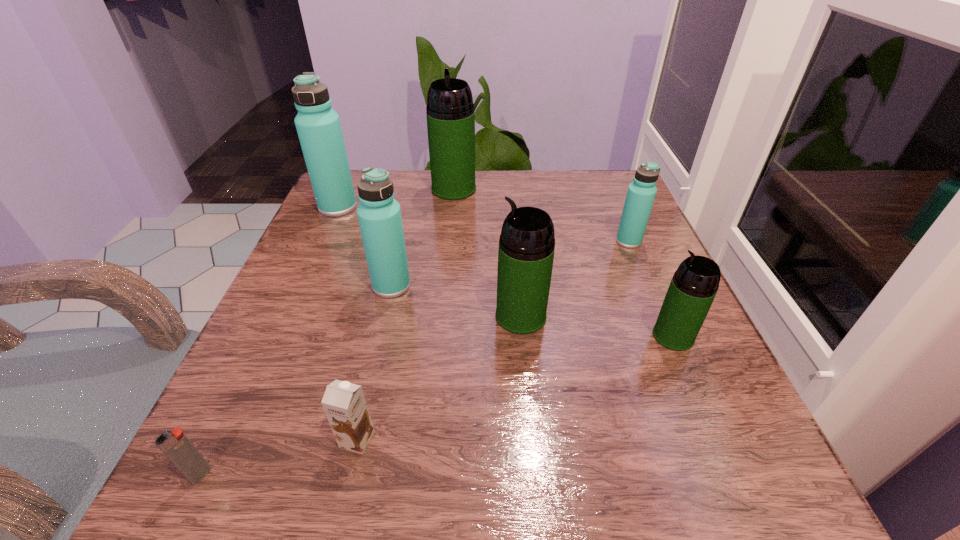
Find the location of `vacant area that lies between the nearest object and the biggest aqua thermos bottle`. vacant area that lies between the nearest object and the biggest aqua thermos bottle is located at coordinates (269, 341).

Where is `free spot between the fifth object from left to right and the leftmost thermos bottle`? The height and width of the screenshot is (540, 960). free spot between the fifth object from left to right and the leftmost thermos bottle is located at coordinates (396, 198).

At what (x,y) coordinates should I click in order to perform the action: click on vacant area between the nearest object and the second farthest aqua thermos bottle. Please return your answer as a coordinate pair (x, y). Looking at the image, I should click on (415, 357).

Find the location of a particular element. This screenshot has height=540, width=960. free space between the rightmost green thermos bottle and the second farthest aqua thermos bottle is located at coordinates coord(651,288).

Find the location of a particular element. free space between the shortest object and the biggest green thermos bottle is located at coordinates (327, 332).

Locate an element on the screen. This screenshot has height=540, width=960. free area in between the seventh farthest object and the biggest aqua thermos bottle is located at coordinates 348,323.

Where is `vacant space that is in between the third farthest thermos bottle and the chocolate milk`? This screenshot has width=960, height=540. vacant space that is in between the third farthest thermos bottle and the chocolate milk is located at coordinates (492, 340).

The image size is (960, 540). Find the location of `unoccupied area between the chocolate milk and the smallest green thermos bottle`. unoccupied area between the chocolate milk and the smallest green thermos bottle is located at coordinates (516, 388).

Where is `the seventh closest object to the second thermos bottle from left to right`? This screenshot has width=960, height=540. the seventh closest object to the second thermos bottle from left to right is located at coordinates (641, 192).

At what (x,y) coordinates should I click in order to perform the action: click on object that ranks as the seventh closest to the smallest green thermos bottle. Please return your answer as a coordinate pair (x, y). The height and width of the screenshot is (540, 960). Looking at the image, I should click on (318, 126).